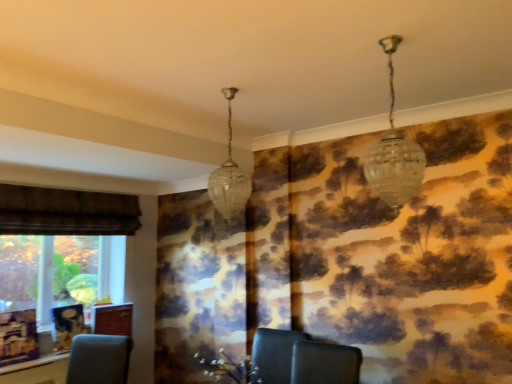
Question: From a real-world perspective, does clear glass chandelier at upper right, the second lamp from the left, sit lower than clear glass pendant light at center, which is counted as the 1th lamp, starting from the back?

Choices:
 (A) no
 (B) yes

Answer: (A)

Question: Is clear glass chandelier at upper right, acting as the 1th lamp starting from the front, smaller than clear glass pendant light at center, positioned as the second lamp in front-to-back order?

Choices:
 (A) no
 (B) yes

Answer: (A)

Question: Considering the relative sizes of clear glass chandelier at upper right, acting as the 1th lamp starting from the front, and clear glass pendant light at center, positioned as the second lamp in front-to-back order, in the image provided, is clear glass chandelier at upper right, acting as the 1th lamp starting from the front, taller than clear glass pendant light at center, positioned as the second lamp in front-to-back order,?

Choices:
 (A) no
 (B) yes

Answer: (A)

Question: Does clear glass chandelier at upper right, the second lamp from the left, turn towards clear glass pendant light at center, the 2th lamp positioned from the right?

Choices:
 (A) no
 (B) yes

Answer: (A)

Question: Is clear glass chandelier at upper right, which is counted as the 2th lamp, starting from the back, beside clear glass pendant light at center, positioned as the second lamp in front-to-back order?

Choices:
 (A) no
 (B) yes

Answer: (A)

Question: Are clear glass chandelier at upper right, which is counted as the 2th lamp, starting from the back, and clear glass pendant light at center, which is the 1th lamp in left-to-right order, located far from each other?

Choices:
 (A) no
 (B) yes

Answer: (A)

Question: Is clear glass pendant light at center, the 2th lamp positioned from the right, oriented away from clear glass chandelier at upper right, acting as the 1th lamp starting from the front?

Choices:
 (A) no
 (B) yes

Answer: (A)

Question: Does clear glass pendant light at center, the 2th lamp positioned from the right, lie behind clear glass chandelier at upper right, which is counted as the 2th lamp, starting from the back?

Choices:
 (A) no
 (B) yes

Answer: (B)

Question: Is clear glass pendant light at center, which is the 1th lamp in left-to-right order, shorter than clear glass chandelier at upper right, the second lamp from the left?

Choices:
 (A) yes
 (B) no

Answer: (B)

Question: Is clear glass pendant light at center, positioned as the second lamp in front-to-back order, wider than clear glass chandelier at upper right, which is counted as the 2th lamp, starting from the back?

Choices:
 (A) no
 (B) yes

Answer: (A)

Question: Does clear glass pendant light at center, the 2th lamp positioned from the right, have a larger size compared to clear glass chandelier at upper right, acting as the 1th lamp starting from the front?

Choices:
 (A) yes
 (B) no

Answer: (B)

Question: From a real-world perspective, does clear glass pendant light at center, which is counted as the 1th lamp, starting from the back, sit lower than clear glass chandelier at upper right, the second lamp from the left?

Choices:
 (A) no
 (B) yes

Answer: (B)

Question: From a real-world perspective, is clear glass pendant light at center, the 2th lamp positioned from the right, positioned above or below clear glass chandelier at upper right, which is the 1th lamp in right-to-left order?

Choices:
 (A) below
 (B) above

Answer: (A)